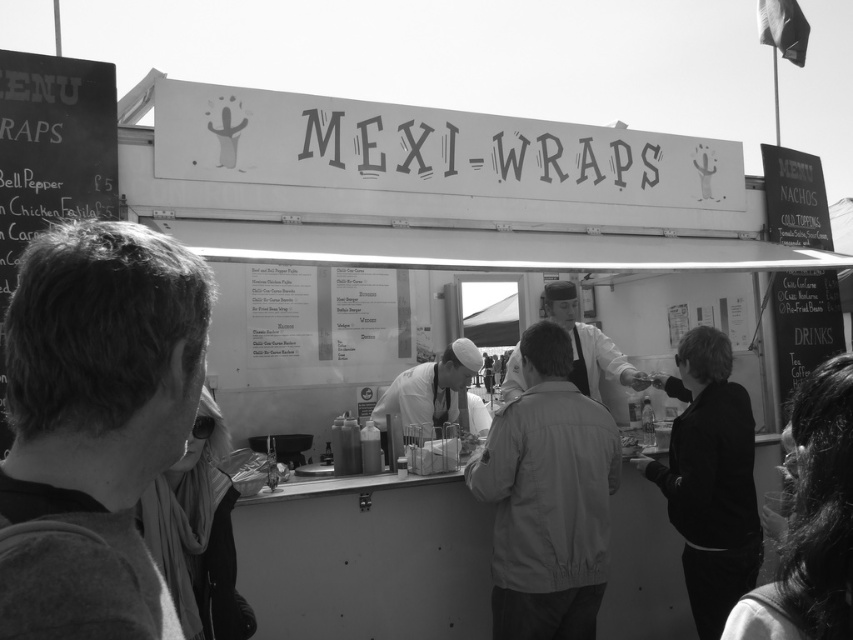
You are standing in front of the Mexi Wraps stall and want to reach a point that is 37.39 inches away from you. Is the point at coordinates point (35, 500) within your reach?

The point (35, 500) is 37.39 inches away from the viewer, so if you can reach up to 37.39 inches, then yes, you can reach it. Otherwise, you might need to adjust your position.

You are a customer at the Mexi Wraps stall and want to order a Bell Pepper wrap. The staff member in the smooth black shirt at lower left is busy serving another customer. Can you approach the chalkboard menu at left to view the prices while waiting?

The smooth black shirt at lower left is 2.31 meters away from the chalkboard menu at left. Since the distance is manageable, you can easily walk over to the chalkboard menu at left to view the prices while waiting.

You are a customer at the Mexi Wraps stall and want to ask for a menu. Which staff member is closer to you, the one wearing the smooth black shirt at lower left or the smooth white shirt at center?

The smooth black shirt at lower left is closer to the viewer than the smooth white shirt at center, so you should ask the staff member wearing the smooth black shirt at lower left.